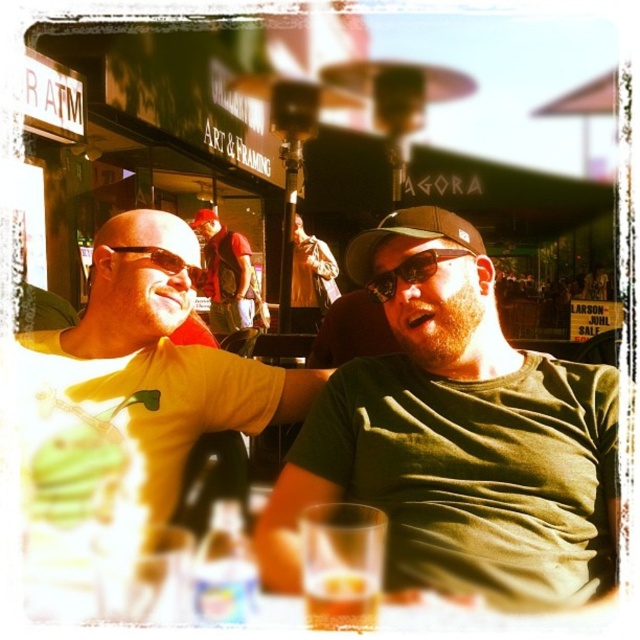
Question: Which point is farther from the camera taking this photo?

Choices:
 (A) (136, 323)
 (B) (368, 268)
 (C) (193, 221)
 (D) (172, 268)

Answer: (C)

Question: Can you confirm if green matte shirt at center is positioned above red shirt at center?

Choices:
 (A) no
 (B) yes

Answer: (A)

Question: Does red shirt at center appear under matte black sunglasses at left?

Choices:
 (A) yes
 (B) no

Answer: (A)

Question: Which point is farther to the camera?

Choices:
 (A) sunglasses at center
 (B) green fabric baseball cap at center
 (C) translucent glass at lower center

Answer: (B)

Question: Which of the following is the farthest from the observer?

Choices:
 (A) (129, 252)
 (B) (310, 576)

Answer: (A)

Question: Is red shirt at center above translucent glass at lower center?

Choices:
 (A) yes
 (B) no

Answer: (A)